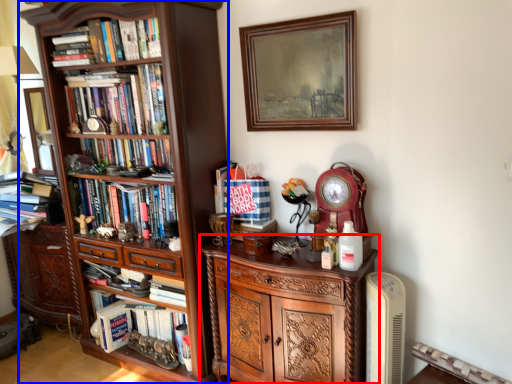
Question: Which point is further to the camera, cabinetry (highlighted by a red box) or bookcase (highlighted by a blue box)?

Choices:
 (A) cabinetry
 (B) bookcase

Answer: (B)